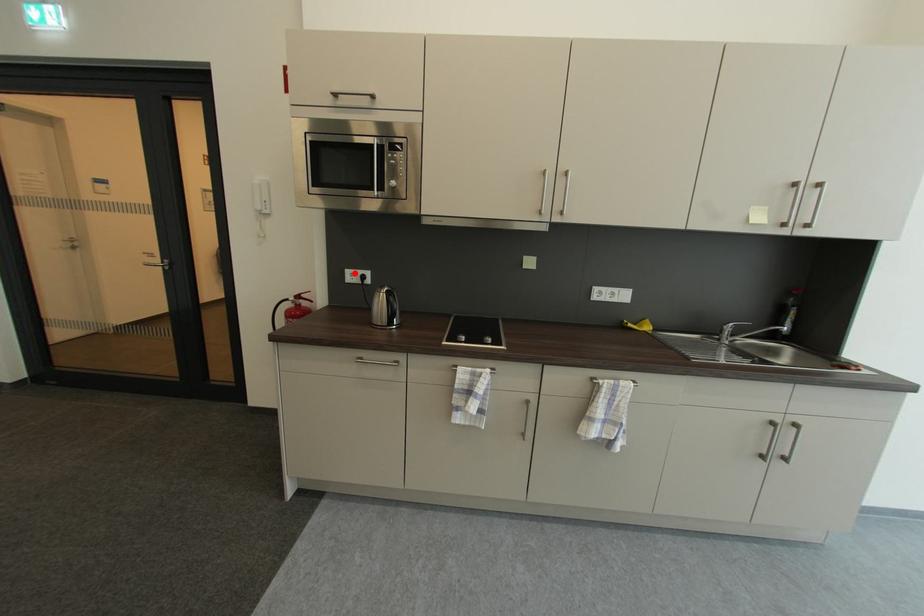
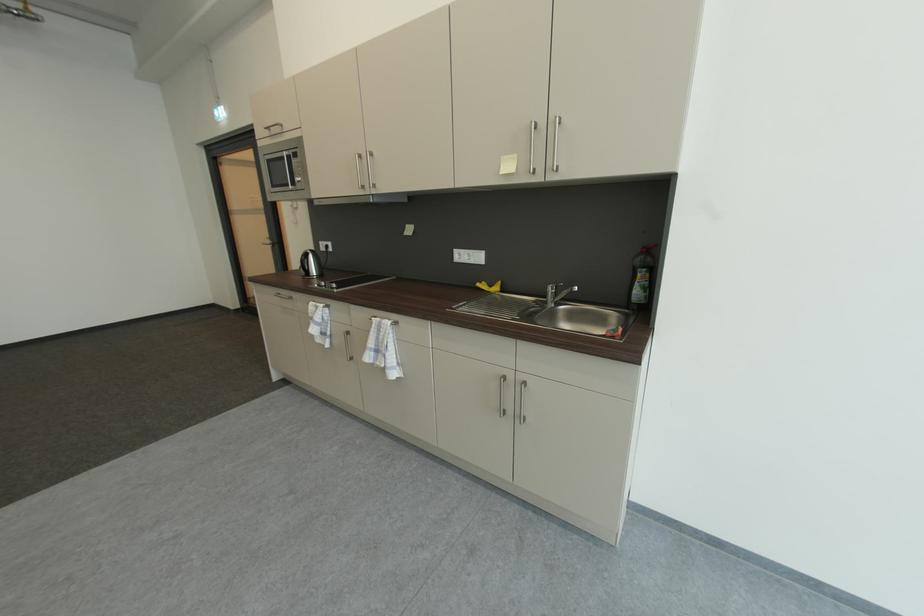
Question: I am providing you with two images of the same scene from different viewpoints. A red point is marked on the first image. At the location where the point appears in image 1, is it still visible in image 2?

Choices:
 (A) Yes
 (B) No

Answer: (A)